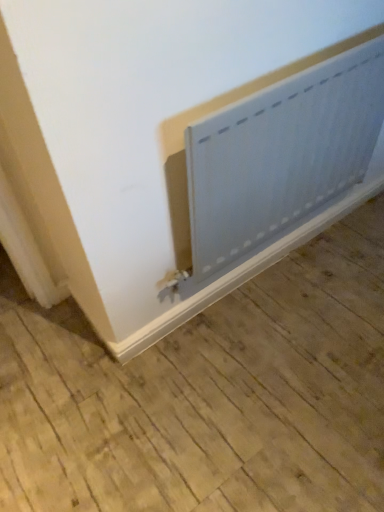
Question: Is white matte radiator at lower center taller or shorter than matte gray radiator at lower right?

Choices:
 (A) short
 (B) tall

Answer: (B)

Question: From the image's perspective, relative to matte gray radiator at lower right, is white matte radiator at lower center above or below?

Choices:
 (A) above
 (B) below

Answer: (A)

Question: Is point (240, 198) closer or farther from the camera than point (91, 358)?

Choices:
 (A) closer
 (B) farther

Answer: (A)

Question: Does point (233, 496) appear closer or farther from the camera than point (203, 138)?

Choices:
 (A) farther
 (B) closer

Answer: (A)

Question: Considering the positions of matte gray radiator at lower right and white matte radiator at lower center in the image, is matte gray radiator at lower right wider or thinner than white matte radiator at lower center?

Choices:
 (A) wide
 (B) thin

Answer: (A)

Question: Is matte gray radiator at lower right bigger or smaller than white matte radiator at lower center?

Choices:
 (A) small
 (B) big

Answer: (B)

Question: Choose the correct answer: Is matte gray radiator at lower right inside white matte radiator at lower center or outside it?

Choices:
 (A) outside
 (B) inside

Answer: (A)